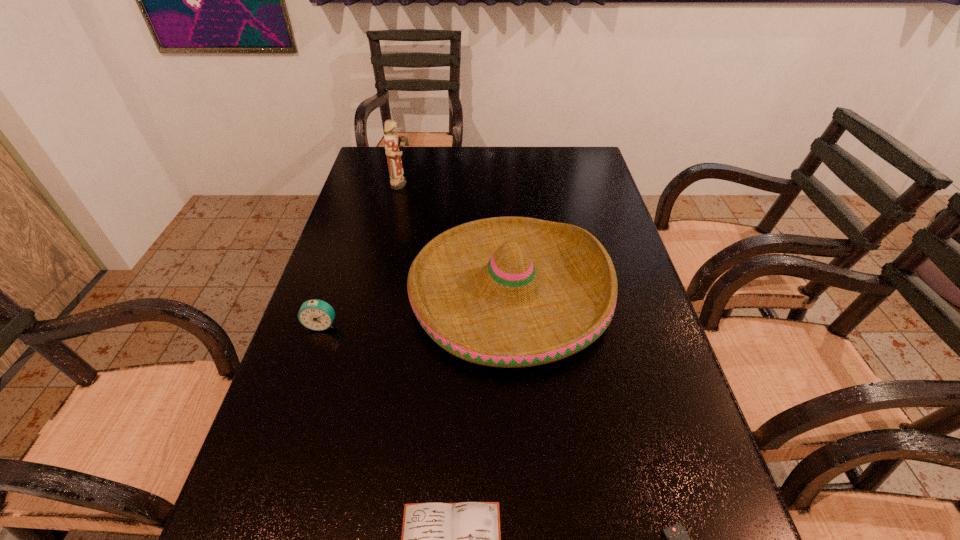
Locate which object ranks third in proximity to the farthest object. Please provide its 2D coordinates. Your answer should be formatted as a tuple, i.e. [(x, y)], where the tuple contains the x and y coordinates of a point satisfying the conditions above.

[(463, 539)]

Where is `object that stands as the closest to the third tallest object`? The height and width of the screenshot is (540, 960). object that stands as the closest to the third tallest object is located at coordinates (510, 292).

I want to click on blank space that satisfies the following two spatial constraints: 1. on the front-facing side of the fourth shortest object; 2. on the right side of the second object from left to right, so click(x=377, y=292).